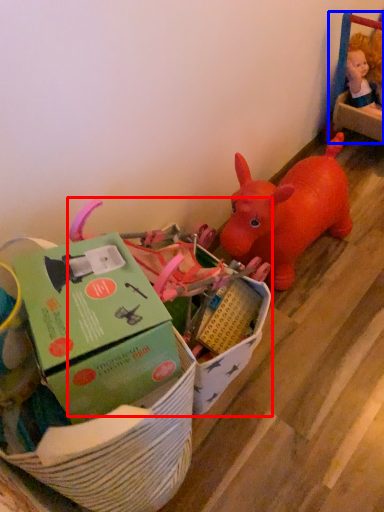
Question: Which object appears closest to the camera in this image, toy (highlighted by a red box) or toy (highlighted by a blue box)?

Choices:
 (A) toy
 (B) toy

Answer: (A)